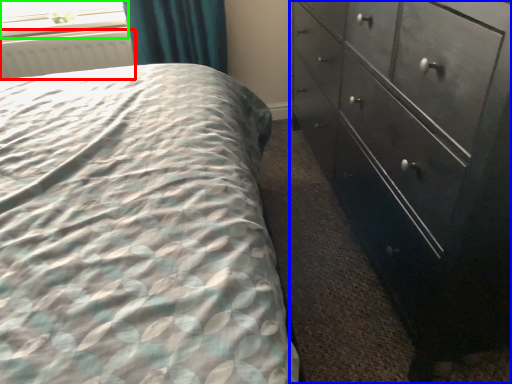
Question: Which object is positioned farthest from radiator (highlighted by a red box)? Select from chest of drawers (highlighted by a blue box) and window screen (highlighted by a green box).

Choices:
 (A) chest of drawers
 (B) window screen

Answer: (A)